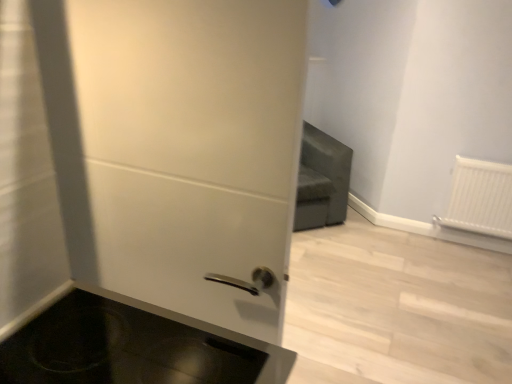
Question: Visually, is white matte door at center positioned to the left or to the right of black glass cooktop at lower left?

Choices:
 (A) right
 (B) left

Answer: (B)

Question: Do you think white matte door at center is within black glass cooktop at lower left, or outside of it?

Choices:
 (A) inside
 (B) outside

Answer: (B)

Question: Estimate the real-world distances between objects in this image. Which object is closer to the white plastic radiator at right?

Choices:
 (A) black glass cooktop at lower left
 (B) white matte door at center

Answer: (B)

Question: Which object is the closest to the white plastic radiator at right?

Choices:
 (A) white matte door at center
 (B) black glass cooktop at lower left

Answer: (A)